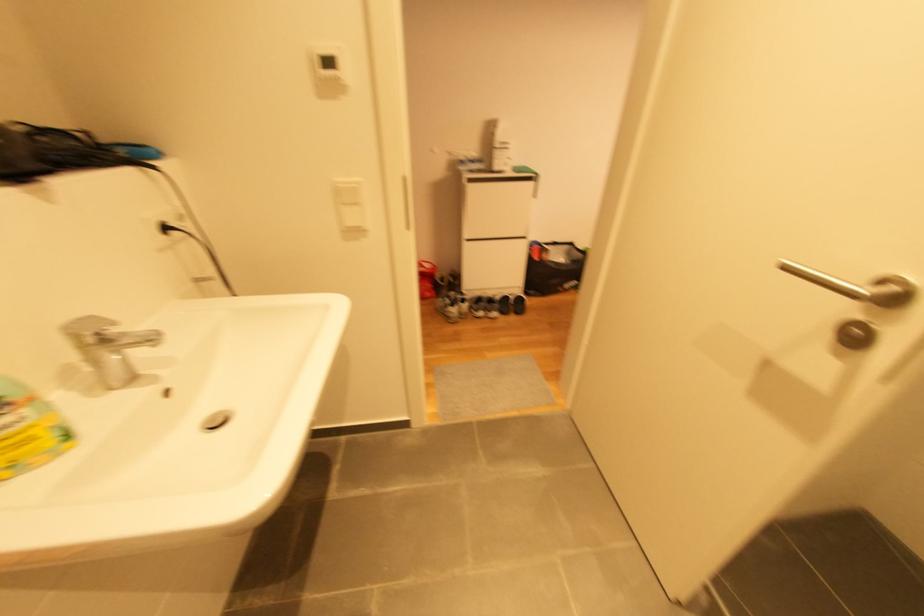
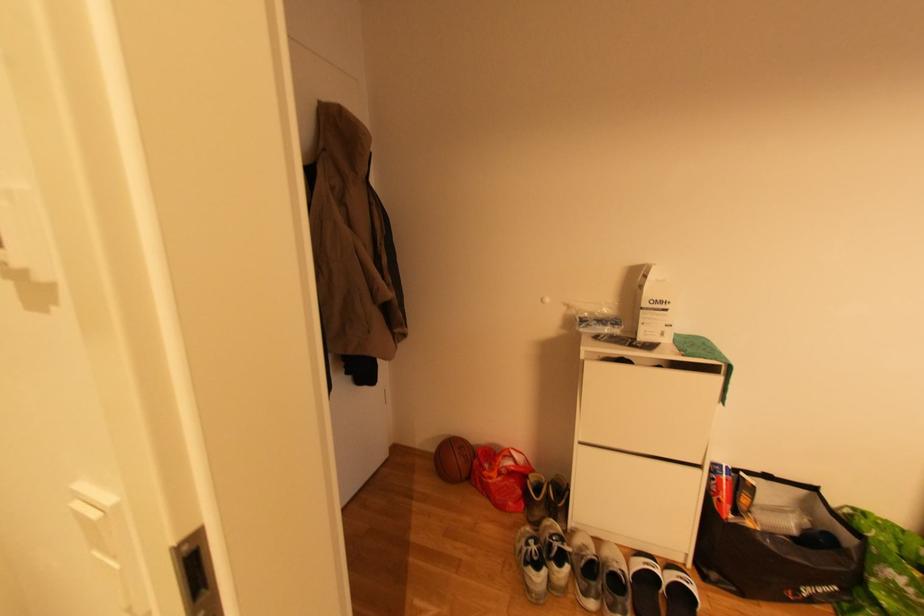
Question: How did the camera likely rotate?

Choices:
 (A) Left
 (B) Right
 (C) Up
 (D) Down

Answer: (A)